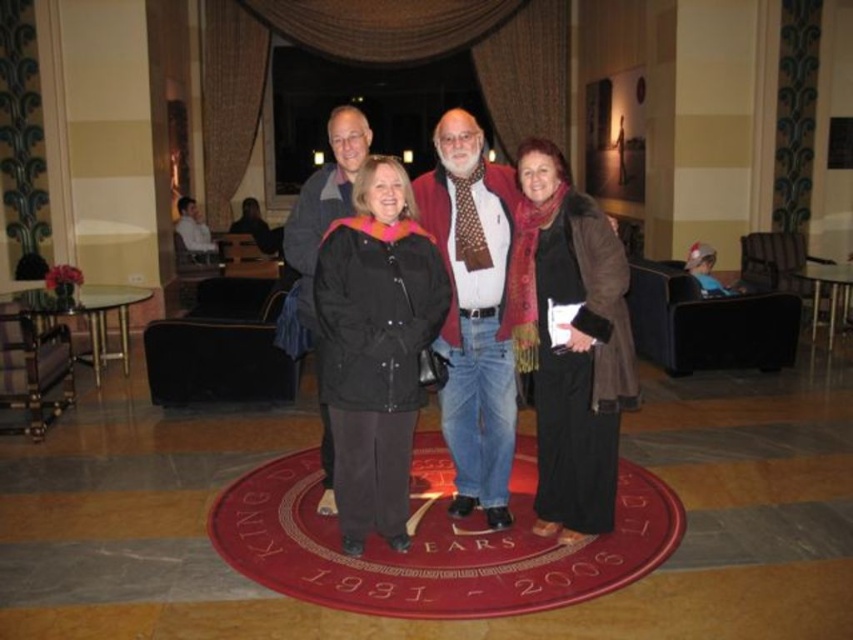
Question: Based on their relative distances, which object is nearer to the matte black jacket at center?

Choices:
 (A) matte black coat at center
 (B) red wool sweater at center
 (C) brown leather coat at center
 (D) black jacket at center

Answer: (B)

Question: Estimate the real-world distances between objects in this image. Which object is farther from the brown leather coat at center?

Choices:
 (A) red wool sweater at center
 (B) matte black jacket at center

Answer: (A)

Question: Does red wool sweater at center have a larger size compared to black jacket at center?

Choices:
 (A) no
 (B) yes

Answer: (B)

Question: Can you confirm if matte black coat at center is bigger than matte black jacket at center?

Choices:
 (A) no
 (B) yes

Answer: (A)

Question: Which object is closer to the camera taking this photo?

Choices:
 (A) black jacket at center
 (B) red wool sweater at center
 (C) matte black jacket at center

Answer: (C)

Question: Is matte black coat at center to the right of brown leather coat at center from the viewer's perspective?

Choices:
 (A) yes
 (B) no

Answer: (B)